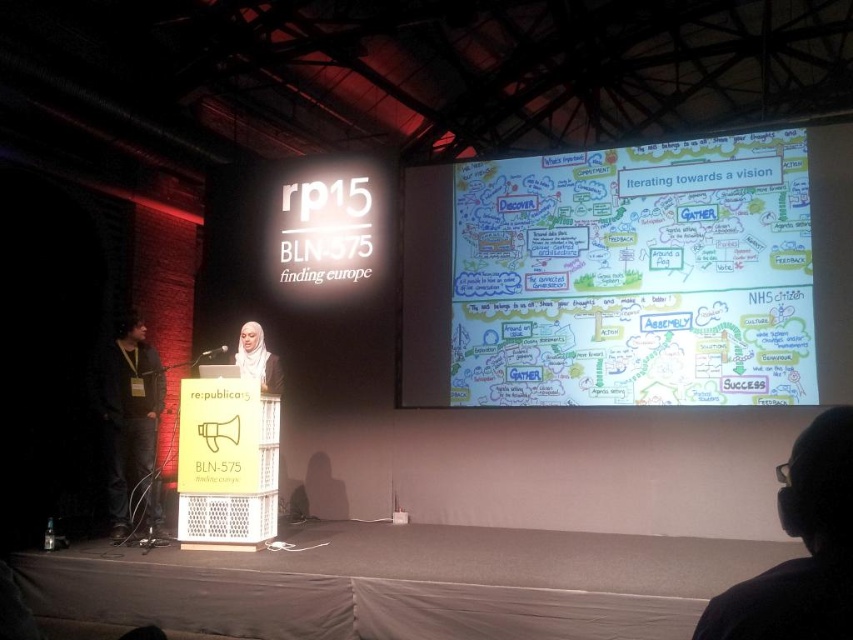
Question: Can you confirm if white paperboard at upper center is positioned to the left of black fabric at left?

Choices:
 (A) yes
 (B) no

Answer: (B)

Question: Which point appears farthest from the camera in this image?

Choices:
 (A) coord(234,355)
 (B) coord(444,278)
 (C) coord(137,317)

Answer: (B)

Question: Does white paperboard at upper center lie behind matte white hijab at center?

Choices:
 (A) yes
 (B) no

Answer: (A)

Question: Which object appears farthest from the camera in this image?

Choices:
 (A) white paperboard at upper center
 (B) black fabric at left

Answer: (A)

Question: Based on their relative distances, which object is nearer to the matte white hijab at center?

Choices:
 (A) black fabric at left
 (B) white paperboard at upper center

Answer: (A)

Question: Is black fabric at left to the right of matte white hijab at center from the viewer's perspective?

Choices:
 (A) yes
 (B) no

Answer: (B)